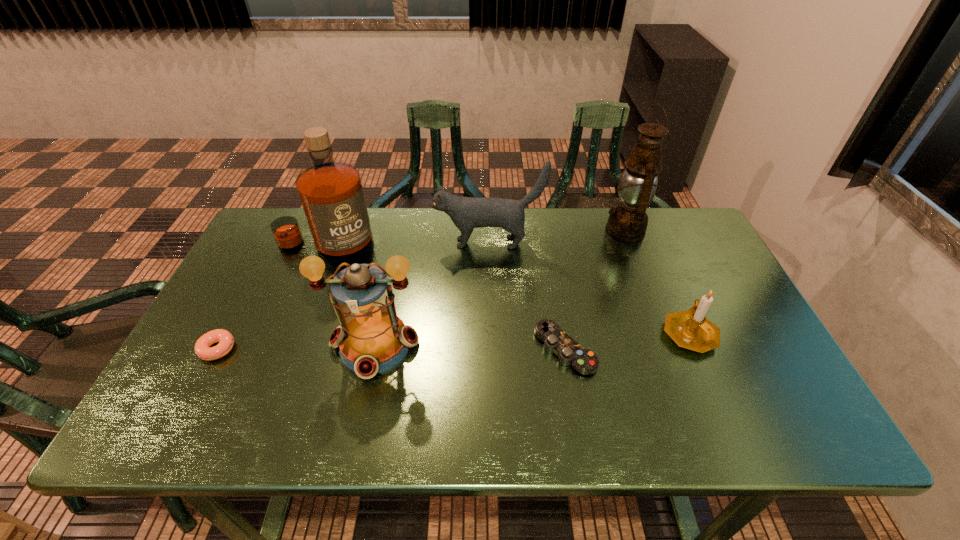
Image resolution: width=960 pixels, height=540 pixels. I want to click on oil lamp, so click(627, 222).

This screenshot has height=540, width=960. Find the location of `liquor`. liquor is located at coordinates (331, 193).

In order to click on cat in this screenshot , I will do `click(467, 213)`.

Identify the location of lantern. The image size is (960, 540). (371, 338).

Locate an element on the screen. The width and height of the screenshot is (960, 540). the third shortest object is located at coordinates (690, 329).

Image resolution: width=960 pixels, height=540 pixels. Identify the location of control. (569, 352).

Image resolution: width=960 pixels, height=540 pixels. Find the location of `doughnut`. doughnut is located at coordinates (202, 348).

In order to click on free space located 0.080m on the left of the oil lamp in this screenshot , I will do `click(579, 231)`.

Where is `free point located on the front label of the liquor`? free point located on the front label of the liquor is located at coordinates (309, 292).

Locate an element on the screen. The height and width of the screenshot is (540, 960). vacant point located at the face of the cat is located at coordinates (360, 243).